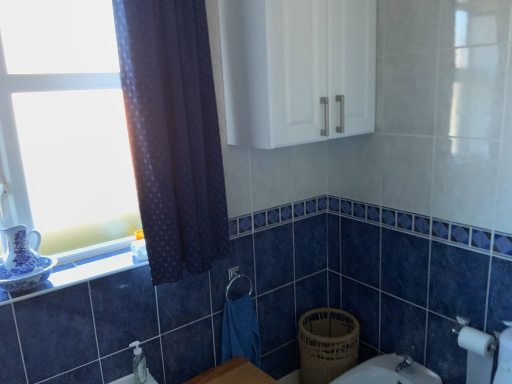
Where is `dark blue sheer curtain at left`? This screenshot has width=512, height=384. dark blue sheer curtain at left is located at coordinates (173, 133).

This screenshot has width=512, height=384. What are the coordinates of `white glass window at left` in the screenshot? It's located at (15, 126).

Measure the distance between white glass window at left and camera.

The distance of white glass window at left from camera is 1.39 meters.

This screenshot has width=512, height=384. What are the coordinates of `white matte toilet paper at lower right` in the screenshot? It's located at (477, 354).

You are a GUI agent. You are given a task and a screenshot of the screen. Output one action in this format:
    pyautogui.click(x=<x>, y=<y>)
    Task: Click on the woven brown basket at lower right
    This screenshot has height=384, width=512.
    Given the screenshot: What is the action you would take?
    pyautogui.click(x=327, y=344)

The image size is (512, 384). What do you see at coordinates (327, 344) in the screenshot?
I see `woven brown basket at lower right` at bounding box center [327, 344].

What is the approximate height of clear plastic soap dispenser at lower center?

It is 6.85 inches.

This screenshot has width=512, height=384. Identify the location of white glossy window sill at lower left. (81, 270).

Can you see clear plastic soap dispenser at lower center touching dark blue sheer curtain at left?

No, clear plastic soap dispenser at lower center is not next to dark blue sheer curtain at left.

Image resolution: width=512 pixels, height=384 pixels. I want to click on curtain in front of the clear plastic soap dispenser at lower center, so click(173, 133).

From the image's perspective, would you say clear plastic soap dispenser at lower center is positioned over dark blue sheer curtain at left?

No, from the image's perspective, clear plastic soap dispenser at lower center is not over dark blue sheer curtain at left.

Is point (137, 352) closer or farther from the camera than point (170, 23)?

Point (137, 352) is positioned farther from the camera compared to point (170, 23).

Considering the sizes of objects clear plastic soap dispenser at lower center and blue porcelain tea pot at left in the image provided, who is taller, clear plastic soap dispenser at lower center or blue porcelain tea pot at left?

blue porcelain tea pot at left.

Identify the location of tea pot lying on the left of clear plastic soap dispenser at lower center. (19, 251).

Who is more distant, clear plastic soap dispenser at lower center or blue porcelain tea pot at left?

clear plastic soap dispenser at lower center.

Between clear plastic soap dispenser at lower center and blue porcelain tea pot at left, which one appears on the right side from the viewer's perspective?

From the viewer's perspective, clear plastic soap dispenser at lower center appears more on the right side.

Find the location of a particular element. Image resolution: width=512 pixels, height=384 pixels. window located in front of the white glossy window sill at lower left is located at coordinates (15, 126).

Between white glossy window sill at lower left and white glass window at left, which one has more height?

white glass window at left.

From a real-world perspective, who is located higher, white glossy window sill at lower left or white glass window at left?

In real-world perspective, white glass window at left is above.

Does point (80, 249) come in front of point (145, 154)?

No.

Is blue porcelain tea pot at left next to woven brown basket at lower right?

No, blue porcelain tea pot at left is not next to woven brown basket at lower right.

From their relative heights in the image, would you say blue porcelain tea pot at left is taller or shorter than woven brown basket at lower right?

In the image, blue porcelain tea pot at left appears to be shorter than woven brown basket at lower right.

Locate an element on the screen. tea pot above the woven brown basket at lower right (from the image's perspective) is located at coordinates (19, 251).

Is the position of blue porcelain tea pot at left more distant than that of woven brown basket at lower right?

No, blue porcelain tea pot at left is closer to the viewer.

Can you confirm if woven brown basket at lower right is shorter than white glossy window sill at lower left?

No, woven brown basket at lower right is not shorter than white glossy window sill at lower left.

Can white glossy window sill at lower left be found inside woven brown basket at lower right?

No, white glossy window sill at lower left is not inside woven brown basket at lower right.

The width and height of the screenshot is (512, 384). I want to click on basket on the right of white glossy window sill at lower left, so click(327, 344).

Looking at this image, from the image's perspective, would you say woven brown basket at lower right is shown under white glass window at left?

Correct, woven brown basket at lower right appears lower than white glass window at left in the image.

Which is more to the right, woven brown basket at lower right or white glass window at left?

Positioned to the right is woven brown basket at lower right.

At what (x,y) coordinates should I click in order to perform the action: click on window in front of the woven brown basket at lower right. Please return your answer as a coordinate pair (x, y). Looking at the image, I should click on (15, 126).

Between woven brown basket at lower right and white glass window at left, which one has less height?

With less height is woven brown basket at lower right.

From a real-world perspective, is white glossy window sill at lower left below white matte toilet paper at lower right?

Actually, white glossy window sill at lower left is physically above white matte toilet paper at lower right in the real world.

Identify the location of toilet paper lying on the right of white glossy window sill at lower left. (477, 354).

From the image's perspective, which one is positioned higher, white glossy window sill at lower left or white matte toilet paper at lower right?

From the image's view, white glossy window sill at lower left is above.

Considering the sizes of objects white glossy window sill at lower left and white matte toilet paper at lower right in the image provided, who is taller, white glossy window sill at lower left or white matte toilet paper at lower right?

With more height is white matte toilet paper at lower right.

The width and height of the screenshot is (512, 384). Find the location of `toiletry on the left of dark blue sheer curtain at left`. toiletry on the left of dark blue sheer curtain at left is located at coordinates (138, 363).

You are a GUI agent. You are given a task and a screenshot of the screen. Output one action in this format:
    pyautogui.click(x=<x>, y=<y>)
    Task: Click on the toiletry located underneath the blue porcelain tea pot at left (from a real-world perspective)
    
    Given the screenshot: What is the action you would take?
    pyautogui.click(x=138, y=363)

Based on their spatial positions, is blue porcelain tea pot at left or blue fabric hand towel at lower center further from dark blue sheer curtain at left?

blue porcelain tea pot at left is further to dark blue sheer curtain at left.

From the picture: Considering their positions, is white glossy window sill at lower left positioned further to woven brown basket at lower right than white glossy cabinet at upper center?

white glossy cabinet at upper center lies further to woven brown basket at lower right than the other object.

When comparing their distances from woven brown basket at lower right, does white matte toilet paper at lower right or blue porcelain tea pot at left seem closer?

white matte toilet paper at lower right is closer to woven brown basket at lower right.

Based on their spatial positions, is white glossy cabinet at upper center or blue porcelain tea pot at left further from white glossy window sill at lower left?

white glossy cabinet at upper center.

Based on their spatial positions, is white matte toilet paper at lower right or white glass window at left closer to blue porcelain tea pot at left?

white glass window at left.

When comparing their distances from clear plastic soap dispenser at lower center, does blue fabric hand towel at lower center or white glass window at left seem further?

white glass window at left is positioned further to the anchor clear plastic soap dispenser at lower center.

Estimate the real-world distances between objects in this image. Which object is closer to white glass window at left, white matte toilet paper at lower right or white glossy cabinet at upper center?

The object closer to white glass window at left is white glossy cabinet at upper center.

Based on their spatial positions, is clear plastic soap dispenser at lower center or white glossy window sill at lower left further from white glossy cabinet at upper center?

clear plastic soap dispenser at lower center lies further to white glossy cabinet at upper center than the other object.

Where is `toiletry between white glass window at left and woven brown basket at lower right from left to right`? toiletry between white glass window at left and woven brown basket at lower right from left to right is located at coordinates (138, 363).

Where is `window sill between white glossy cabinet at upper center and blue fabric hand towel at lower center vertically`? The width and height of the screenshot is (512, 384). window sill between white glossy cabinet at upper center and blue fabric hand towel at lower center vertically is located at coordinates (81, 270).

This screenshot has height=384, width=512. In order to click on toilet paper that lies between dark blue sheer curtain at left and woven brown basket at lower right from top to bottom in this screenshot , I will do `click(477, 354)`.

You are a GUI agent. You are given a task and a screenshot of the screen. Output one action in this format:
    pyautogui.click(x=<x>, y=<y>)
    Task: Click on the tea pot between white glossy cabinet at upper center and clear plastic soap dispenser at lower center vertically
    The height and width of the screenshot is (384, 512).
    Given the screenshot: What is the action you would take?
    pyautogui.click(x=19, y=251)